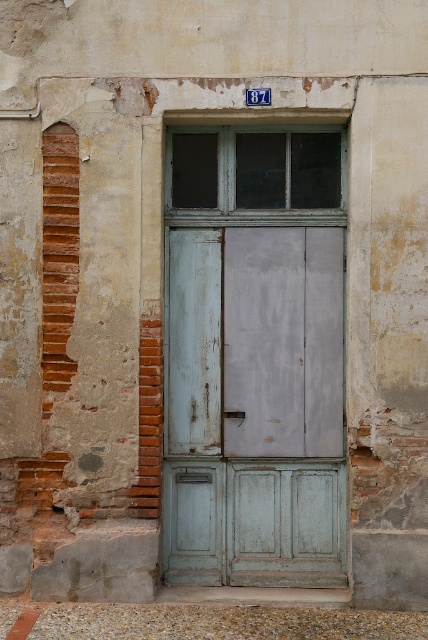
You are standing in front of the light blue wooden door at center and the matte gray wooden window at center. Which one is taller?

The light blue wooden door at center is taller than the matte gray wooden window at center.

You are standing in front of a building with a light blue wooden door at center. If you want to enter through the door, which direction should you walk relative to your current position?

Since the light blue wooden door at center is located at point 0.637 on the x axis and 0.596 on the y axis, you should walk towards the center of the building to reach the door.

You are a painter who needs to cover both the light blue wooden door at center and the matte gray wooden window at center with new paint. Given that the door requires more paint than the window, which object should you paint first to ensure you have enough paint left for both?

The light blue wooden door at center is bigger than the matte gray wooden window at center, so you should paint the light blue wooden door at center first to ensure there is enough paint left for the smaller matte gray wooden window at center.